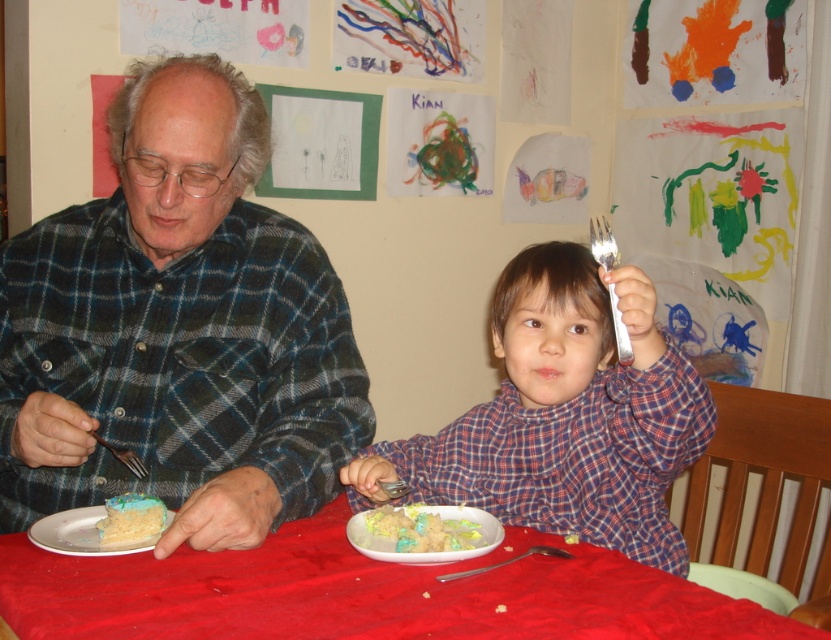
You are a photographer trying to capture a closeup of the pastel frosted cake at lower center without including the matte plaid shirt at left in the frame. Given their sizes, is this possible?

The matte plaid shirt at left is wider than the pastel frosted cake at lower center. Therefore, it is possible to frame the shot so that only the pastel frosted cake at lower center is visible while excluding the matte plaid shirt at left, as the cake is smaller and positioned centrally.

You are standing in front of the table and want to hand a napkin to the matte plaid shirt at left and the red cloth table at center. Which one can you reach first without moving your position?

The matte plaid shirt at left is closer to you than the red cloth table at center, so you can reach the matte plaid shirt at left first without moving.

You are a photographer trying to capture the pastel frosted cake at lower center without the matte plaid shirt at left blocking it. Based on the scene, is the cake currently visible to you?

The matte plaid shirt at left is positioned over pastel frosted cake at lower center, so the cake is partially or fully blocked by the shirt and may not be fully visible.